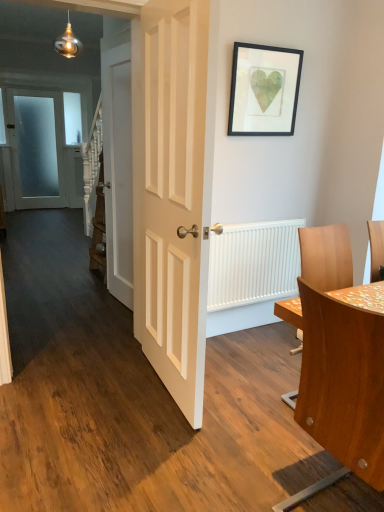
Where is `vacant region under white ribbed radiator at right (from a real-world perspective)`? vacant region under white ribbed radiator at right (from a real-world perspective) is located at coordinates (257, 329).